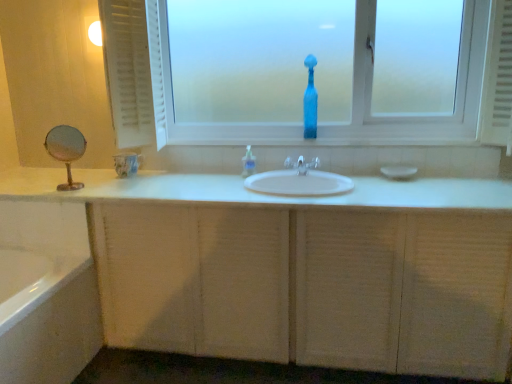
Question: From the image's perspective, is clear plastic faucet at center under white textured radiator at right?

Choices:
 (A) yes
 (B) no

Answer: (A)

Question: Is white textured radiator at right at the back of clear plastic faucet at center?

Choices:
 (A) yes
 (B) no

Answer: (B)

Question: Can you confirm if clear plastic faucet at center is bigger than white textured radiator at right?

Choices:
 (A) no
 (B) yes

Answer: (A)

Question: Considering the relative sizes of clear plastic faucet at center and white textured radiator at right in the image provided, is clear plastic faucet at center taller than white textured radiator at right?

Choices:
 (A) yes
 (B) no

Answer: (B)

Question: Is clear plastic faucet at center thinner than white textured radiator at right?

Choices:
 (A) no
 (B) yes

Answer: (B)

Question: Based on their sizes in the image, would you say transparent glass bottle at center is bigger or smaller than translucent glass vase at center?

Choices:
 (A) small
 (B) big

Answer: (B)

Question: Looking at their shapes, would you say transparent glass bottle at center is wider or thinner than translucent glass vase at center?

Choices:
 (A) thin
 (B) wide

Answer: (B)

Question: From a real-world perspective, is transparent glass bottle at center above or below translucent glass vase at center?

Choices:
 (A) below
 (B) above

Answer: (B)

Question: From the image's perspective, is transparent glass bottle at center positioned above or below translucent glass vase at center?

Choices:
 (A) above
 (B) below

Answer: (A)

Question: Relative to white textured radiator at right, is white matte soap at center in front or behind?

Choices:
 (A) front
 (B) behind

Answer: (B)

Question: From the image's perspective, is white matte soap at center located above or below white textured radiator at right?

Choices:
 (A) below
 (B) above

Answer: (A)

Question: Considering the positions of white matte soap at center and white textured radiator at right in the image, is white matte soap at center taller or shorter than white textured radiator at right?

Choices:
 (A) tall
 (B) short

Answer: (B)

Question: In terms of size, does white matte soap at center appear bigger or smaller than white textured radiator at right?

Choices:
 (A) big
 (B) small

Answer: (B)

Question: Looking at their shapes, would you say white textured radiator at right is wider or thinner than transparent glass bottle at center?

Choices:
 (A) thin
 (B) wide

Answer: (B)

Question: From a real-world perspective, is white textured radiator at right above or below transparent glass bottle at center?

Choices:
 (A) below
 (B) above

Answer: (A)